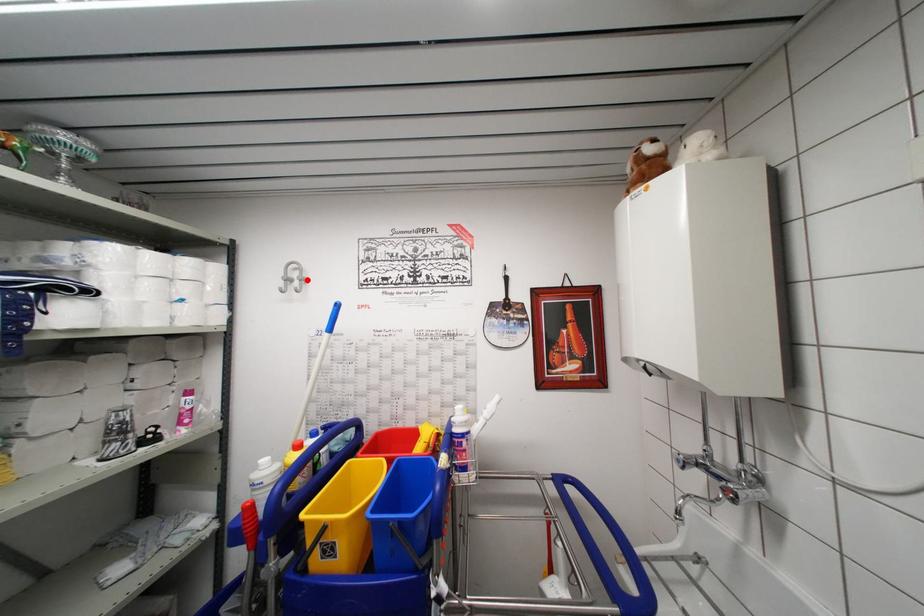
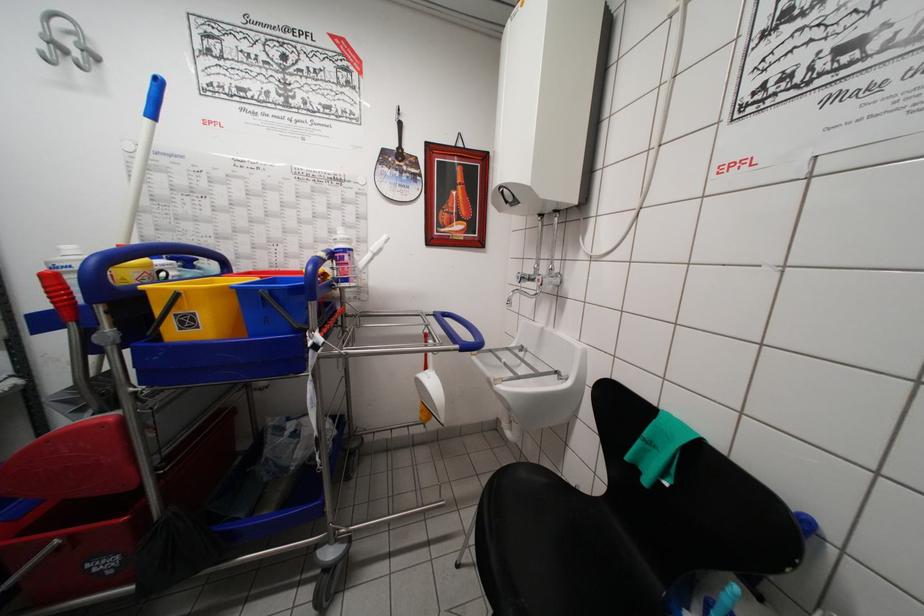
Question: I am providing you with two images of the same scene from different viewpoints. Image1 has a red point marked. In image2, the corresponding 3D location appears at what relative position? Reply with the corresponding letter.

Choices:
 (A) Closer
 (B) Farther

Answer: (B)